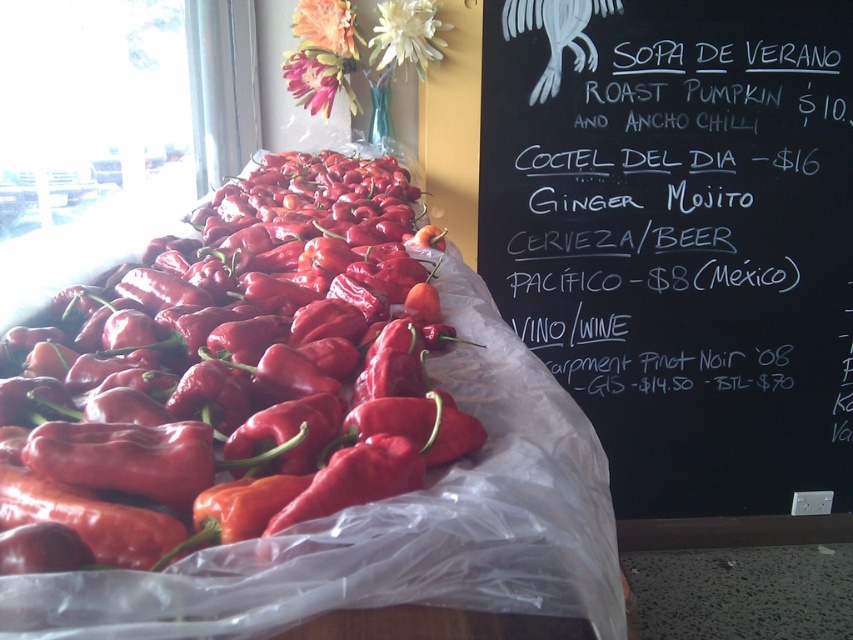
You are a customer at a restaurant and want to read the menu on the black chalkboard at upper right. If your eyes are 5 feet away from the table, can you read the menu without moving closer?

The black chalkboard at upper right is 6.22 feet from the viewer. Since your eyes are only 5 feet away from the table, you are close enough to read the menu on the black chalkboard at upper right without needing to move closer.